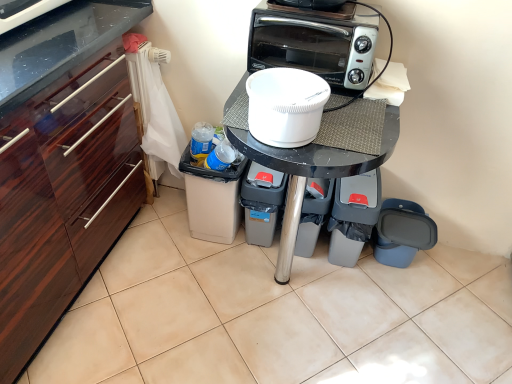
Find the location of a particular element. The image size is (512, 384). free spot in front of gray plastic trash bin at lower center, which is counted as the 4th appliance, starting from the right is located at coordinates (259, 269).